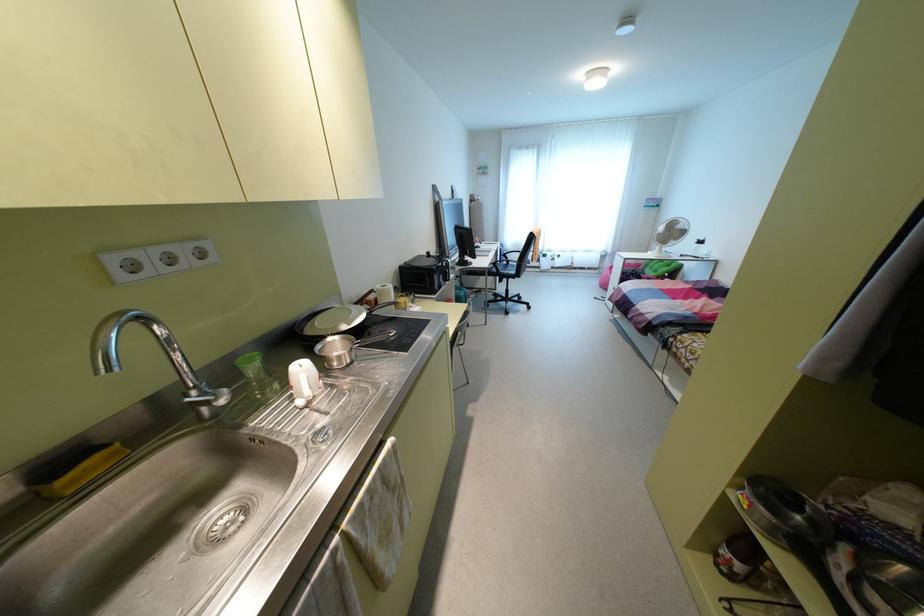
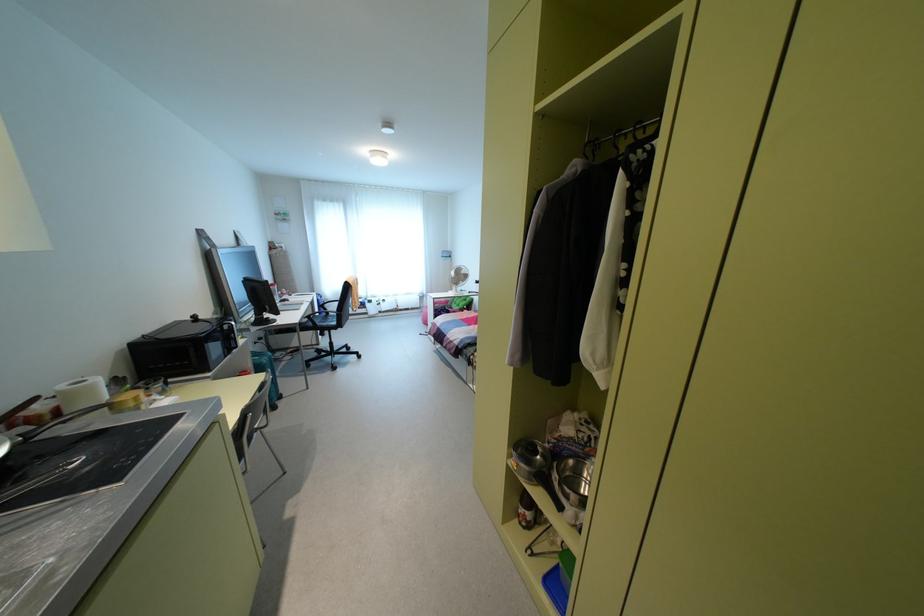
The point at (738,565) is marked in the first image. Where is the corresponding point in the second image?

(528, 515)